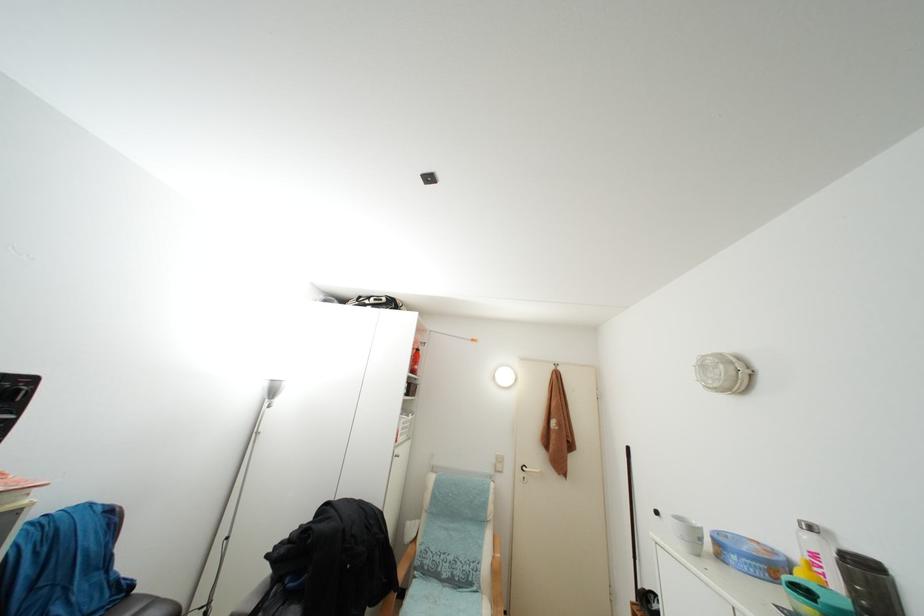
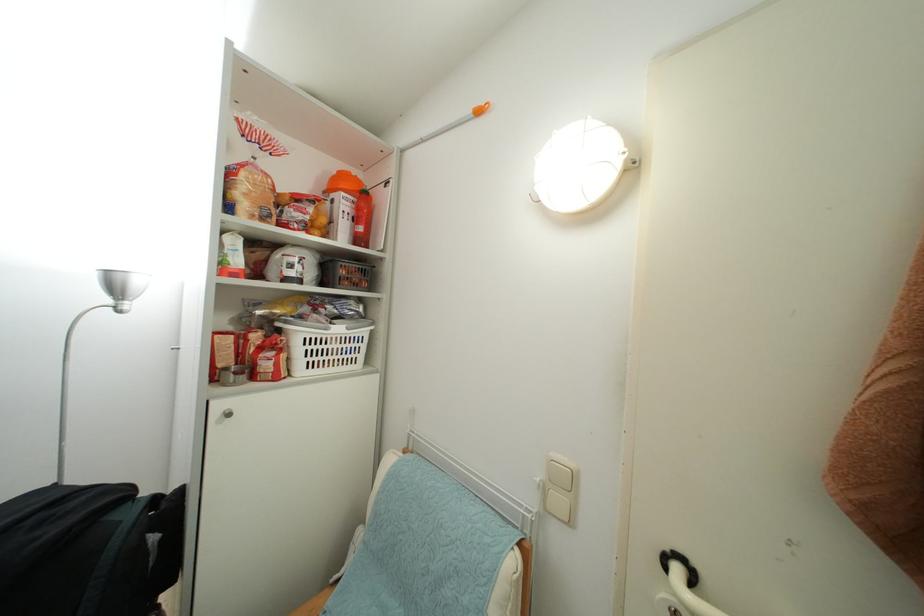
Find the pixel in the second image that matches (419,371) in the first image.

(365, 235)